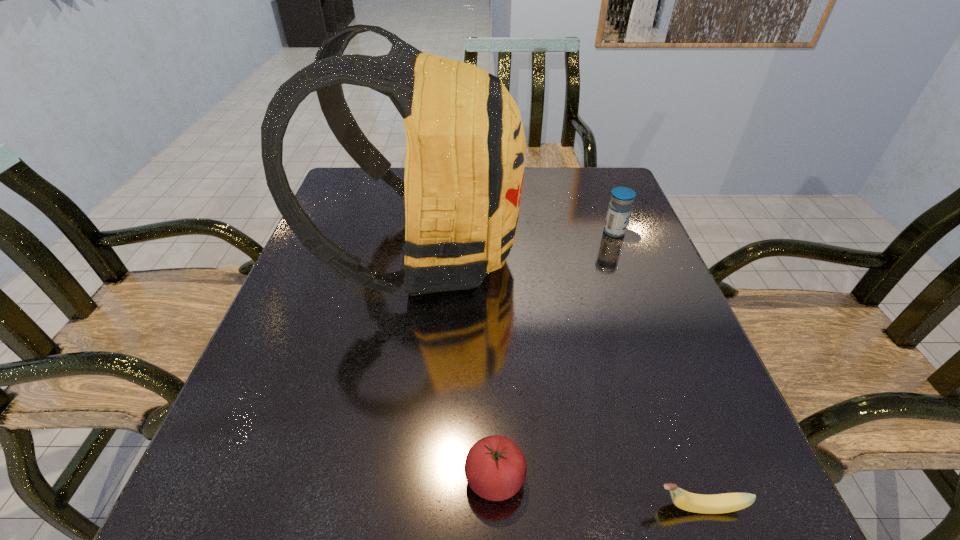
Locate an element on the screen. This screenshot has width=960, height=540. backpack is located at coordinates (465, 150).

Identify the location of the third shortest object. (619, 210).

At what (x,y) coordinates should I click in order to perform the action: click on the third tallest object. Please return your answer as a coordinate pair (x, y). Looking at the image, I should click on (495, 468).

Identify the location of the shortest object. This screenshot has width=960, height=540. (728, 502).

This screenshot has width=960, height=540. I want to click on free location located on the front-facing side of the backpack, so click(639, 254).

At what (x,y) coordinates should I click in order to perform the action: click on blank space located 0.220m on the front of the third shortest object. Please return your answer as a coordinate pair (x, y). Looking at the image, I should click on (640, 301).

The image size is (960, 540). Identify the location of vacant region located 0.150m on the right of the tomato. (625, 478).

This screenshot has width=960, height=540. I want to click on vacant space situated 0.260m at the stem of the shortest object, so click(469, 507).

The height and width of the screenshot is (540, 960). I want to click on vacant space located at the stem of the shortest object, so click(x=449, y=507).

Identify the location of blank space located 0.210m at the stem of the shortest object. Image resolution: width=960 pixels, height=540 pixels. (505, 507).